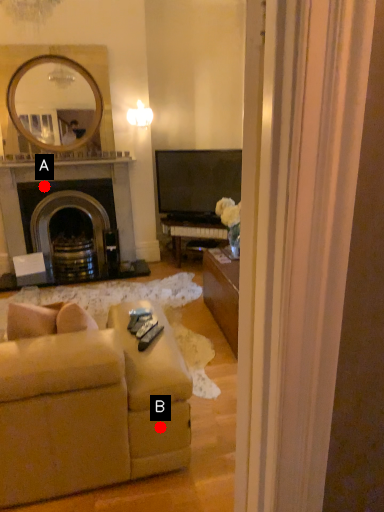
Question: Two points are circled on the image, labeled by A and B beside each circle. Which point is closer to the camera?

Choices:
 (A) A is closer
 (B) B is closer

Answer: (B)